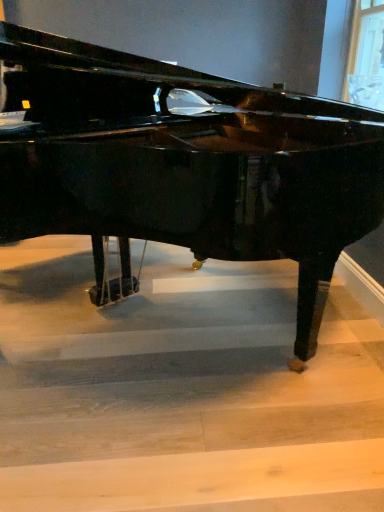
Question: Is glossy black piano at center closer to camera compared to wooden stairwell at center?

Choices:
 (A) no
 (B) yes

Answer: (B)

Question: Does glossy black piano at center appear on the left side of wooden stairwell at center?

Choices:
 (A) yes
 (B) no

Answer: (A)

Question: From a real-world perspective, is glossy black piano at center physically above wooden stairwell at center?

Choices:
 (A) no
 (B) yes

Answer: (B)

Question: Are glossy black piano at center and wooden stairwell at center making contact?

Choices:
 (A) yes
 (B) no

Answer: (B)

Question: Considering the relative sizes of glossy black piano at center and wooden stairwell at center in the image provided, is glossy black piano at center shorter than wooden stairwell at center?

Choices:
 (A) no
 (B) yes

Answer: (A)

Question: Does glossy black piano at center have a larger size compared to wooden stairwell at center?

Choices:
 (A) no
 (B) yes

Answer: (B)

Question: Does wooden stairwell at center have a smaller size compared to glossy black piano at center?

Choices:
 (A) no
 (B) yes

Answer: (B)

Question: Is wooden stairwell at center further to camera compared to glossy black piano at center?

Choices:
 (A) no
 (B) yes

Answer: (B)

Question: Is wooden stairwell at center facing towards glossy black piano at center?

Choices:
 (A) no
 (B) yes

Answer: (A)

Question: Is glossy black piano at center at the back of wooden stairwell at center?

Choices:
 (A) no
 (B) yes

Answer: (A)

Question: Does wooden stairwell at center have a greater width compared to glossy black piano at center?

Choices:
 (A) yes
 (B) no

Answer: (A)

Question: Is wooden stairwell at center located outside glossy black piano at center?

Choices:
 (A) yes
 (B) no

Answer: (A)

Question: Is glossy black piano at center to the left or to the right of wooden stairwell at center in the image?

Choices:
 (A) left
 (B) right

Answer: (A)